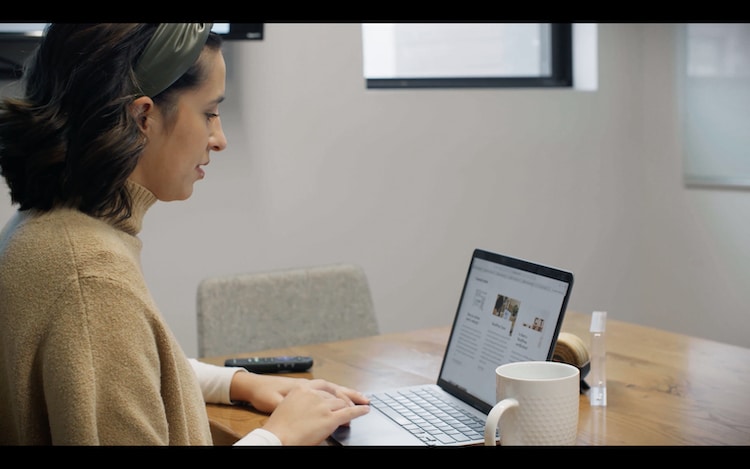
Locate an element on the screen. wall is located at coordinates (476, 190).